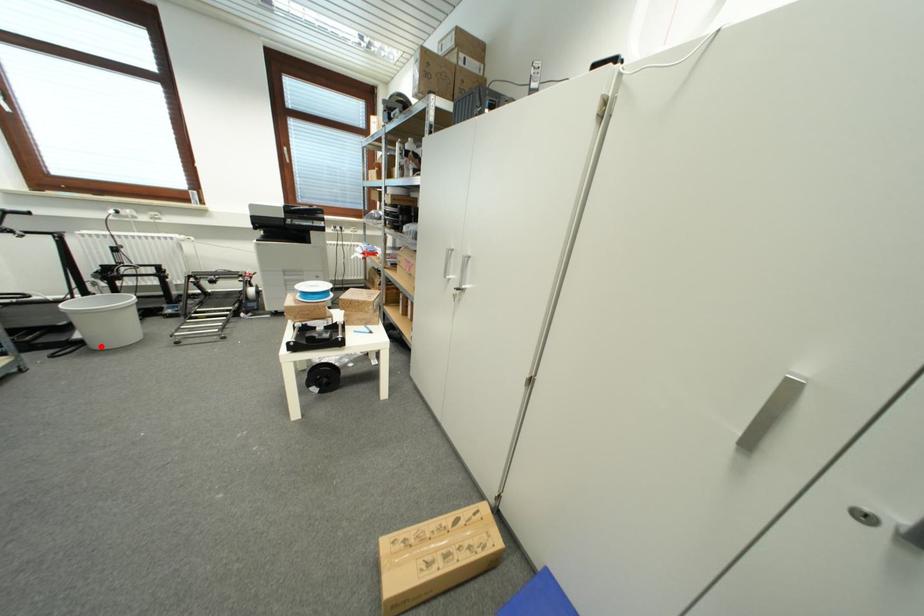
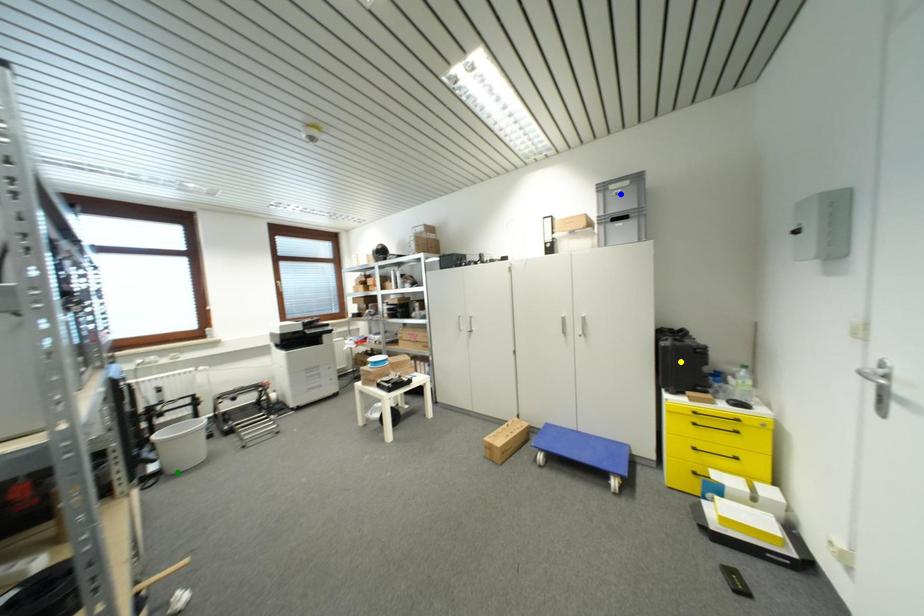
Question: I am providing you with two images of the same scene from different viewpoints. A red point is marked on the first image. You are given multiple points on the second image. In image 2, which mark is for the same physical point as the one in image 1?

Choices:
 (A) green point
 (B) blue point
 (C) yellow point

Answer: (A)